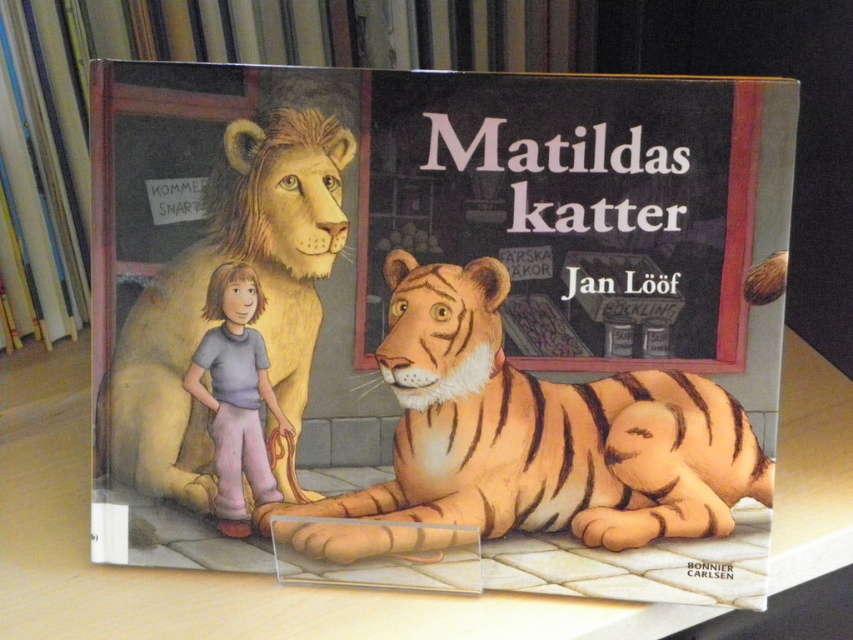
You are a child trying to reach both the orange striped tiger at center and the beige fur lion at left on the book cover. If your arms can stretch 6 inches, can you grab both toys at the same time?

The distance between the orange striped tiger at center and the beige fur lion at left is 6.43 inches. Since your arms can only stretch 6 inches, you cannot reach both at the same time.

You are a child trying to reach both the matte paper book cover at center and the beige fur lion at left on a shelf. Which object can you reach more easily?

The beige fur lion at left is smaller than the matte paper book cover at center, so it might be easier to reach the beige fur lion at left first because it requires less effort to grasp or move.